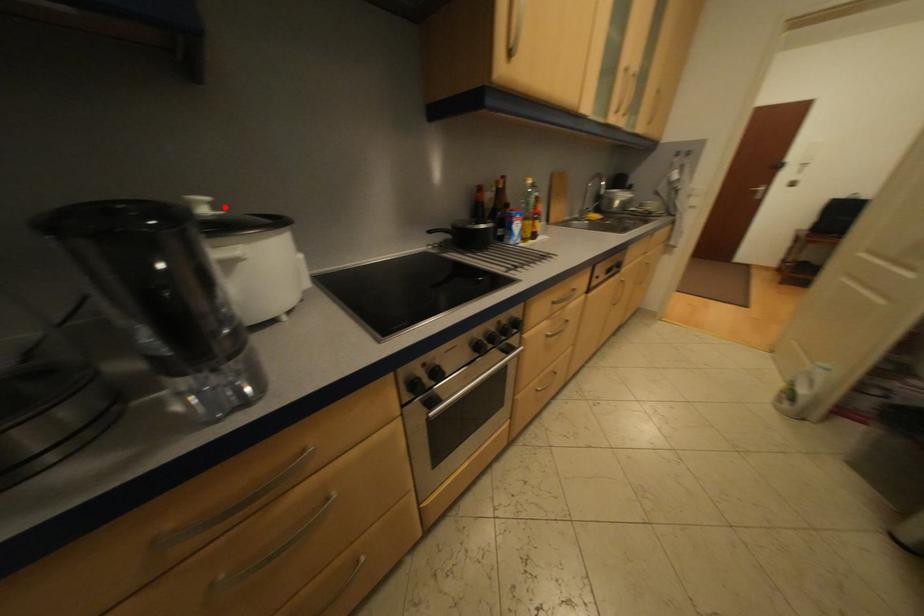
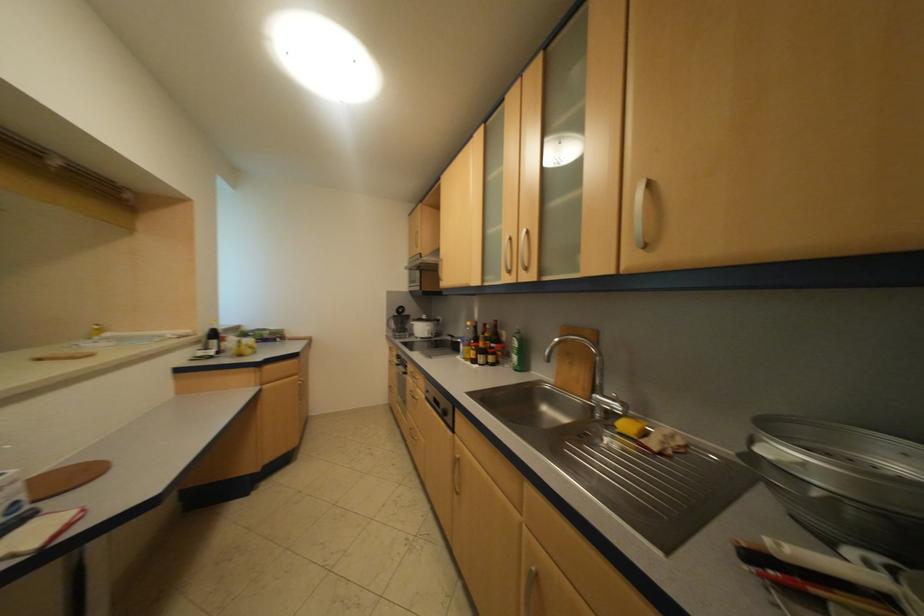
Where in the second image is the point corresponding to the highlighted location from the first image?

(438, 318)